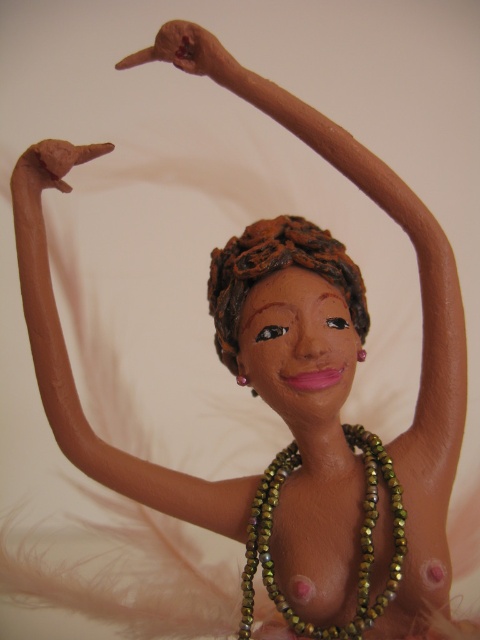
Is green beaded necklace at center above brown clay hair at center?

Actually, green beaded necklace at center is below brown clay hair at center.

Is point (370, 486) less distant than point (266, 244)?

That is True.

At what (x,y) coordinates should I click in order to perform the action: click on green beaded necklace at center. Please return your answer as a coordinate pair (x, y). Looking at the image, I should click on (360, 538).

Who is positioned more to the left, matte clay arm at upper center or brown clay hair at center?

matte clay arm at upper center

Looking at this image, is matte clay arm at upper center smaller than brown clay hair at center?

Actually, matte clay arm at upper center might be larger than brown clay hair at center.

The width and height of the screenshot is (480, 640). Describe the element at coordinates (71, 369) in the screenshot. I see `matte clay arm at upper center` at that location.

Where is `matte clay arm at upper center`? This screenshot has width=480, height=640. matte clay arm at upper center is located at coordinates (71, 369).

You are a GUI agent. You are given a task and a screenshot of the screen. Output one action in this format:
    pyautogui.click(x=<x>, y=<y>)
    Task: Click on the matte clay arm at upper center
    Image resolution: width=480 pixels, height=640 pixels.
    Given the screenshot: What is the action you would take?
    pyautogui.click(x=71, y=369)

Between matte clay arm at upper center and green beaded necklace at center, which one has more height?

matte clay arm at upper center

Find the location of a particular element. The width and height of the screenshot is (480, 640). matte clay arm at upper center is located at coordinates (71, 369).

Where is `matte clay arm at upper center`? The height and width of the screenshot is (640, 480). matte clay arm at upper center is located at coordinates (71, 369).